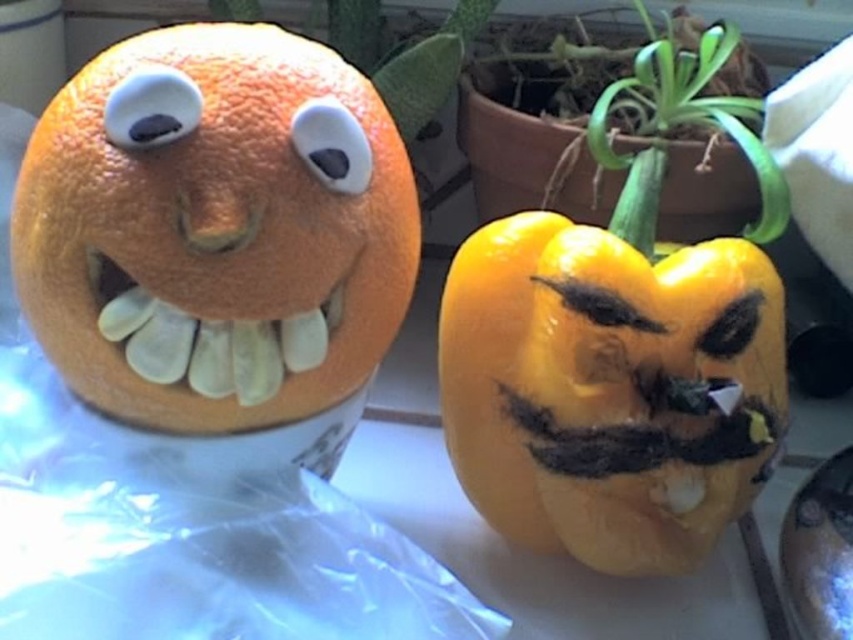
You are an artist trying to replicate the fruit faces. When comparing the white matte eye at center and the black matte eye at center, which one should you make bigger to match the original design?

The white matte eye at center should be made bigger since it has a larger size compared to the black matte eye at center in the original design.